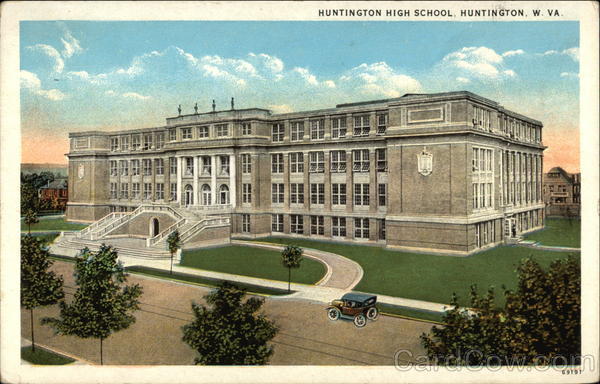
Find the location of a particular element. This screenshot has width=600, height=384. columns is located at coordinates (175, 180), (198, 172), (211, 172), (232, 172).